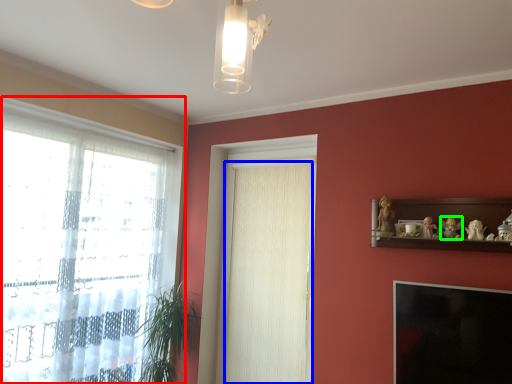
Question: Which object is the farthest from window (highlighted by a red box)? Choose among these: curtain (highlighted by a blue box) or toy (highlighted by a green box).

Choices:
 (A) curtain
 (B) toy

Answer: (B)